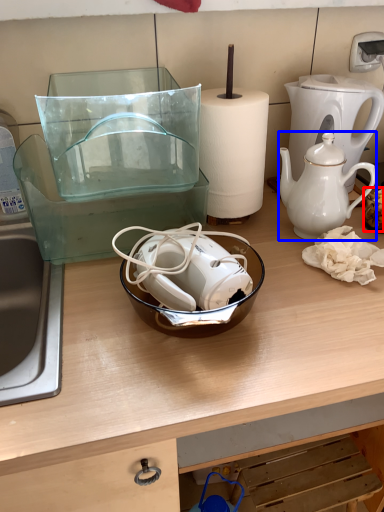
Question: Which point is closer to the camera, food (highlighted by a red box) or teapot (highlighted by a blue box)?

Choices:
 (A) food
 (B) teapot

Answer: (B)